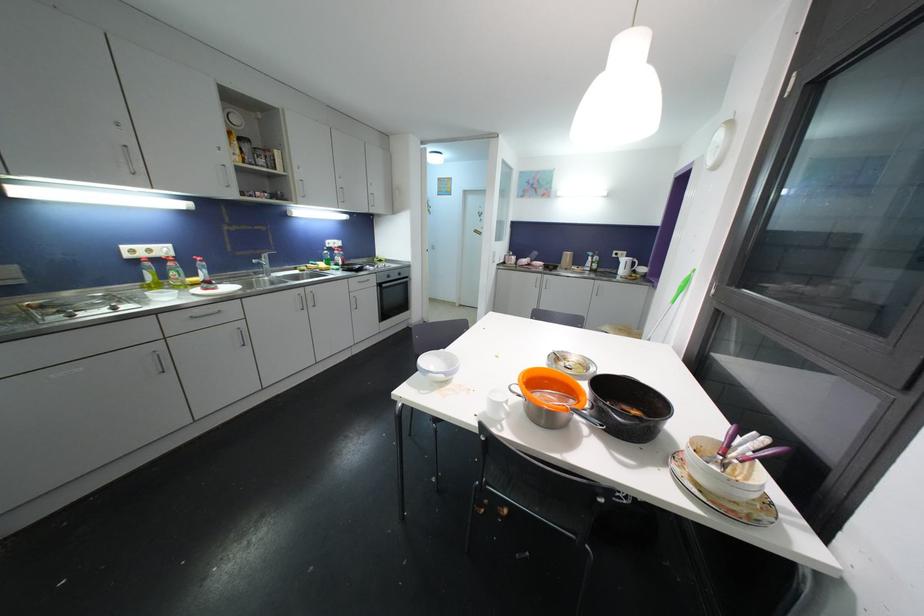
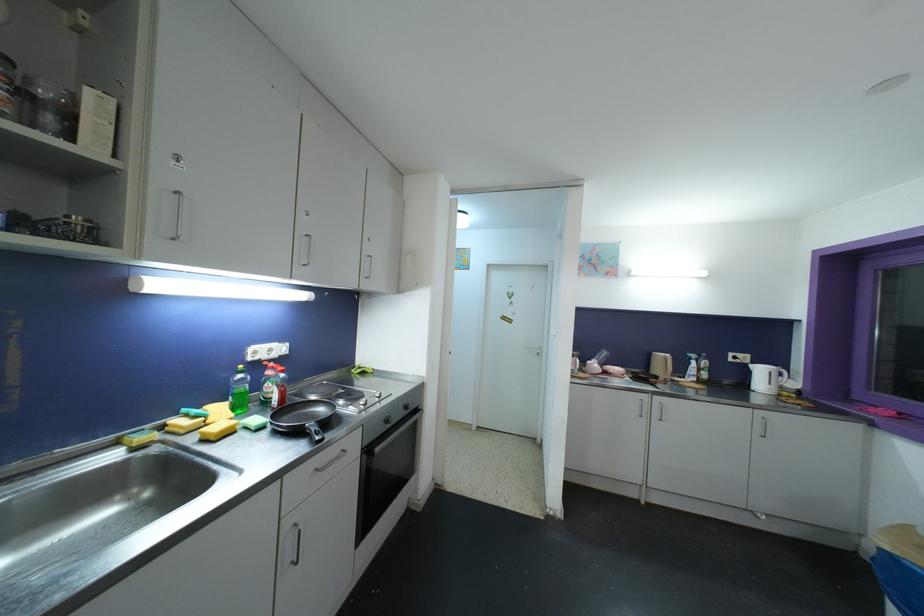
Which direction would the cameraman need to move to produce the second image?

The cameraman walked toward left, forward.